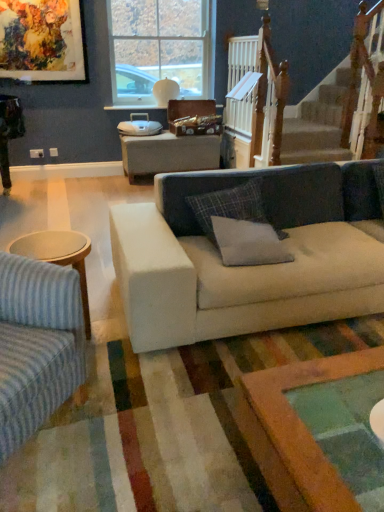
Question: Would you say plaid fabric pillow at center, which is counted as the 2th pillow, starting from the bottom, is to the left or to the right of white wooden railing at upper right in the picture?

Choices:
 (A) left
 (B) right

Answer: (A)

Question: Is point (256, 188) positioned closer to the camera than point (253, 98)?

Choices:
 (A) farther
 (B) closer

Answer: (B)

Question: Which of these objects is positioned closest to the oil painting at upper left?

Choices:
 (A) gray fabric pillow at center, which ranks as the 2th pillow in top-to-bottom order
 (B) plaid fabric pillow at center, which is counted as the 2th pillow, starting from the bottom
 (C) light blue fabric couch at left, placed as the second studio couch when sorted from right to left
 (D) beige fabric couch at center, placed as the second studio couch when sorted from left to right
 (E) clear glass window at upper center

Answer: (E)

Question: Which is nearer to the clear glass window at upper center?

Choices:
 (A) light blue fabric couch at left, positioned as the 1th studio couch in left-to-right order
 (B) oil painting at upper left
 (C) white wooden railing at upper right
 (D) plaid fabric pillow at center, which is the 1th pillow from top to bottom
 (E) gray fabric pillow at center, which appears as the first pillow when ordered from the bottom

Answer: (C)